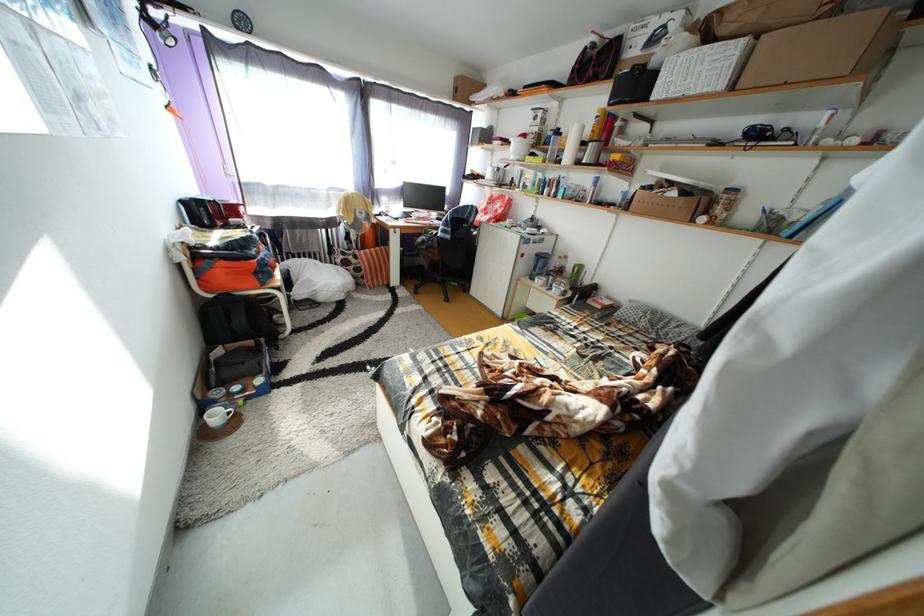
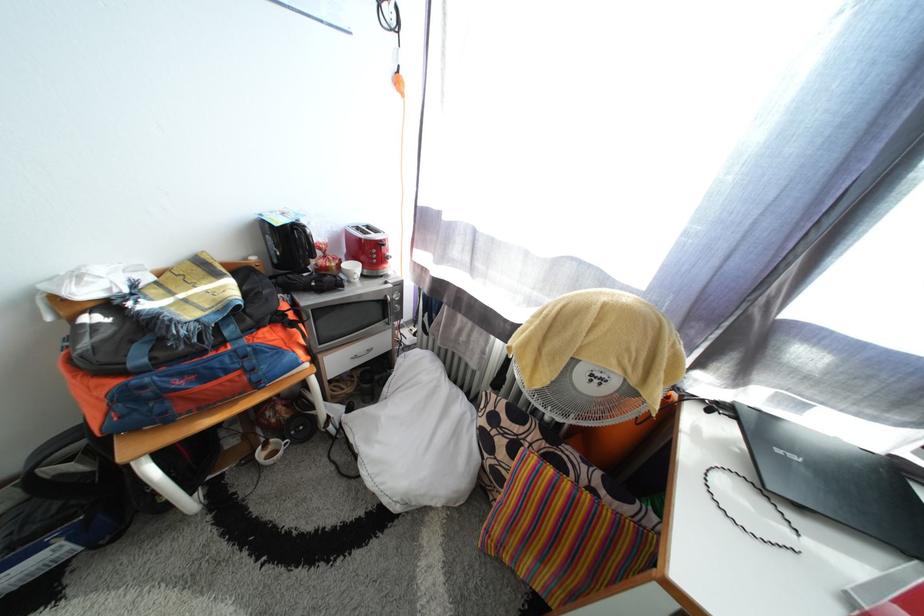
In the second image, find the point that corresponds to point 380,257 in the first image.

(563, 493)